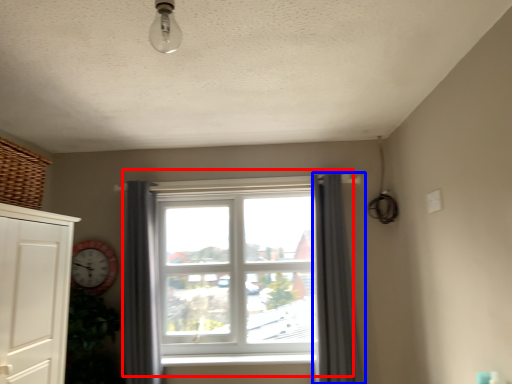
Question: Which object appears closest to the camera in this image, window (highlighted by a red box) or curtain (highlighted by a blue box)?

Choices:
 (A) window
 (B) curtain

Answer: (B)